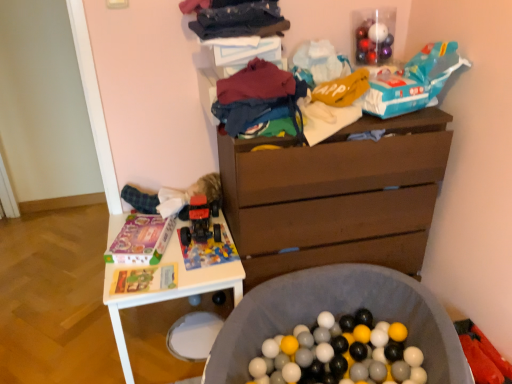
Identify the location of blank space above multicolored fabric at center, marked as the 1th clothing in a bottom-to-top arrangement (from a real-world perspective). coord(258,86).